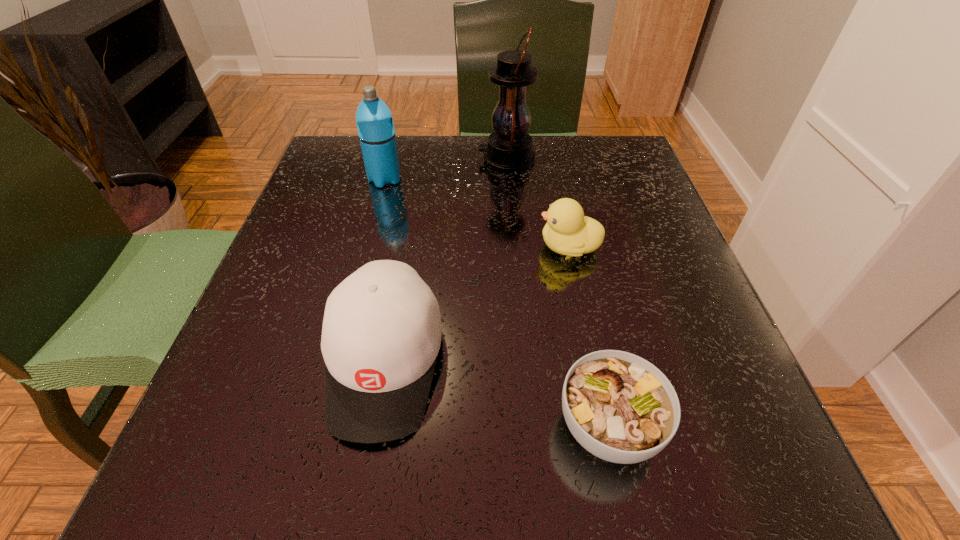
I want to click on free location located on the front-facing side of the baseball cap, so click(362, 490).

Find the location of a particular element. The height and width of the screenshot is (540, 960). vacant position located at the beak of the duckling is located at coordinates (467, 247).

Where is `vacant space situated at the beak of the duckling`? The width and height of the screenshot is (960, 540). vacant space situated at the beak of the duckling is located at coordinates (374, 247).

I want to click on vacant position located at the beak of the duckling, so click(x=435, y=247).

Find the location of a particular element. The height and width of the screenshot is (540, 960). blank space located 0.320m on the left of the shortest object is located at coordinates (310, 427).

Locate an element on the screen. The width and height of the screenshot is (960, 540). lantern that is positioned at the far edge is located at coordinates (509, 149).

This screenshot has width=960, height=540. I want to click on thermos bottle positioned at the far edge, so click(374, 120).

You are a GUI agent. You are given a task and a screenshot of the screen. Output one action in this format:
    pyautogui.click(x=<x>, y=<y>)
    Task: Click on the baseball cap that is at the near edge
    This screenshot has width=960, height=540.
    Given the screenshot: What is the action you would take?
    pyautogui.click(x=381, y=334)

In order to click on soup bowl present at the near edge in this screenshot , I will do `click(621, 408)`.

Image resolution: width=960 pixels, height=540 pixels. I want to click on thermos bottle present at the left edge, so click(x=374, y=120).